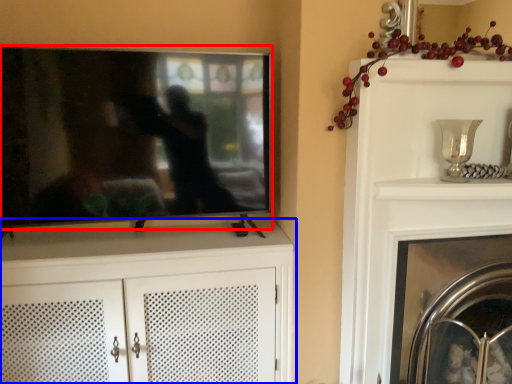
Question: Which object appears closest to the camera in this image, television (highlighted by a red box) or cabinetry (highlighted by a blue box)?

Choices:
 (A) television
 (B) cabinetry

Answer: (A)